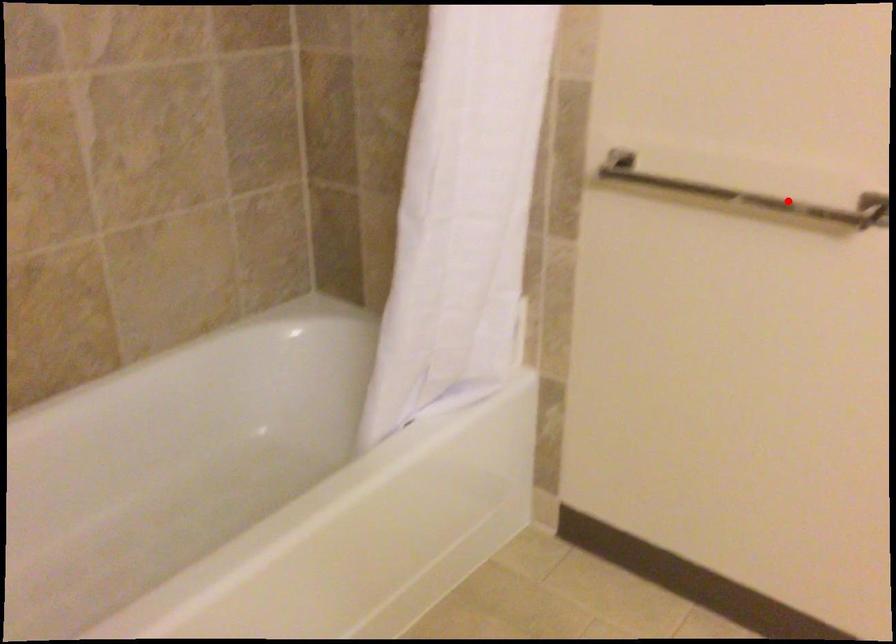
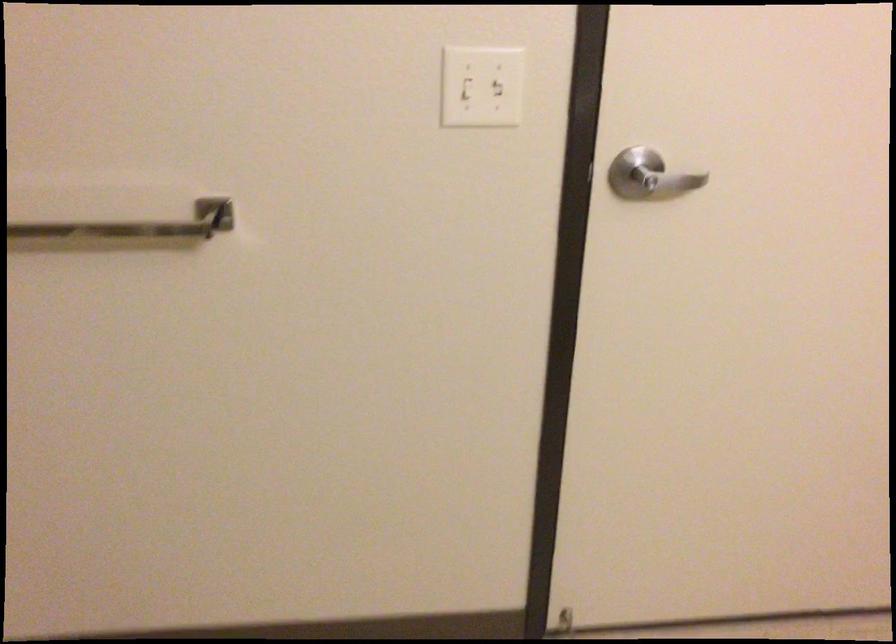
Where in the second image is the point corresponding to the highlighted location from the first image?

(125, 219)